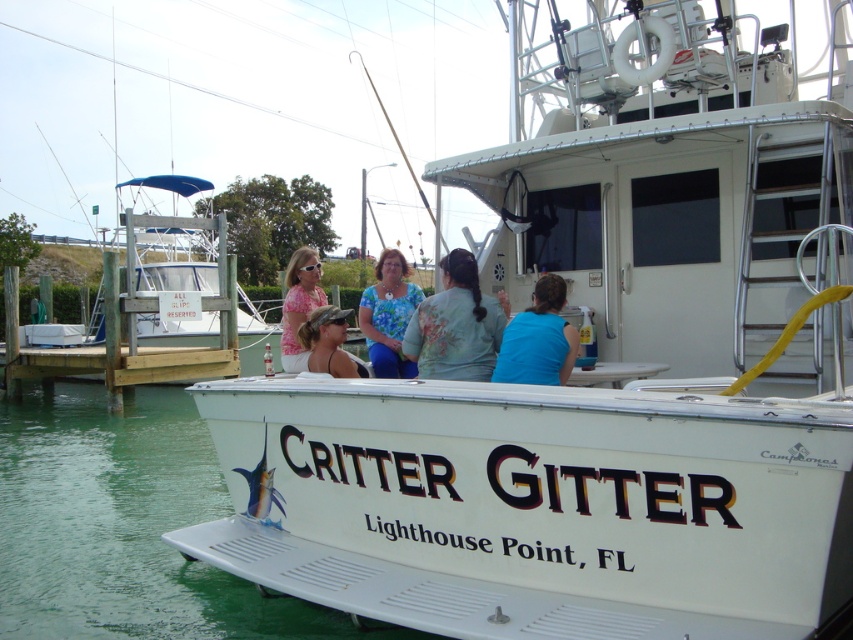
Between blue floral shirt at center and pink fabric shirt at center, which one appears on the left side from the viewer's perspective?

pink fabric shirt at center is more to the left.

Identify the location of blue floral shirt at center. (387, 316).

Image resolution: width=853 pixels, height=640 pixels. What do you see at coordinates (387, 316) in the screenshot?
I see `blue floral shirt at center` at bounding box center [387, 316].

Where is `blue floral shirt at center`? Image resolution: width=853 pixels, height=640 pixels. blue floral shirt at center is located at coordinates (387, 316).

Which of these two, blue floral shirt at center or matte black cap at center, stands shorter?

→ Standing shorter between the two is blue floral shirt at center.

Is point (412, 288) positioned before point (339, 362)?

No, it is behind (339, 362).

Image resolution: width=853 pixels, height=640 pixels. What are the coordinates of `blue floral shirt at center` in the screenshot? It's located at (387, 316).

Which is in front, point (457, 296) or point (383, 266)?

Point (457, 296) is more forward.

Is floral fabric shirt at center to the right of blue floral shirt at center from the viewer's perspective?

Yes, floral fabric shirt at center is to the right of blue floral shirt at center.

This screenshot has height=640, width=853. Describe the element at coordinates (456, 324) in the screenshot. I see `floral fabric shirt at center` at that location.

This screenshot has width=853, height=640. Identify the location of floral fabric shirt at center. (456, 324).